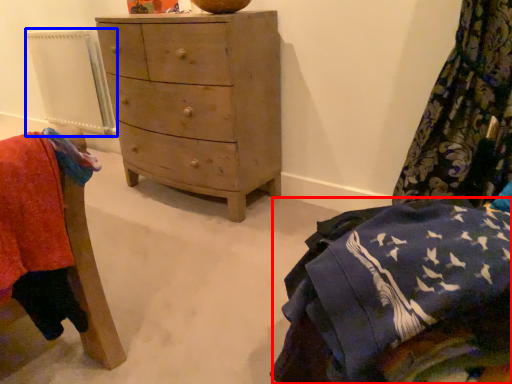
Question: Among these objects, which one is farthest to the camera, clothing (highlighted by a red box) or radiator (highlighted by a blue box)?

Choices:
 (A) clothing
 (B) radiator

Answer: (B)